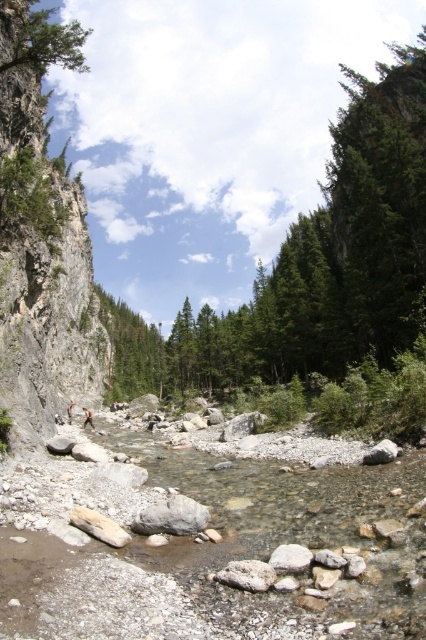
Question: Is the position of rocky cliff at left more distant than that of green matte tree at upper left?

Choices:
 (A) yes
 (B) no

Answer: (B)

Question: Among these objects, which one is nearest to the camera?

Choices:
 (A) green matte tree at upper left
 (B) rocky cliff at left

Answer: (B)

Question: Can you confirm if rocky cliff at left is wider than green matte tree at upper left?

Choices:
 (A) no
 (B) yes

Answer: (B)

Question: Among these points, which one is nearest to the camera?

Choices:
 (A) (8, 192)
 (B) (83, 65)

Answer: (A)

Question: Where is rocky cliff at left located in relation to green matte tree at upper left in the image?

Choices:
 (A) above
 (B) below

Answer: (B)